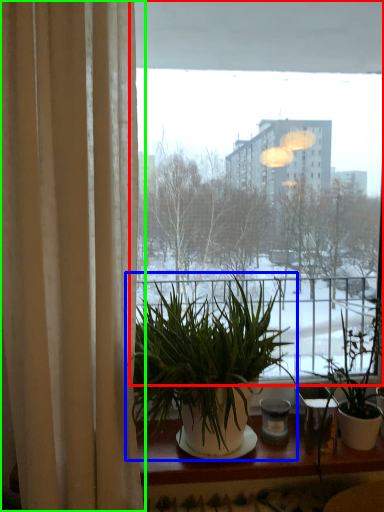
Question: Which object is positioned closest to window (highlighted by a red box)? Select from houseplant (highlighted by a blue box) and curtain (highlighted by a green box).

Choices:
 (A) houseplant
 (B) curtain

Answer: (B)